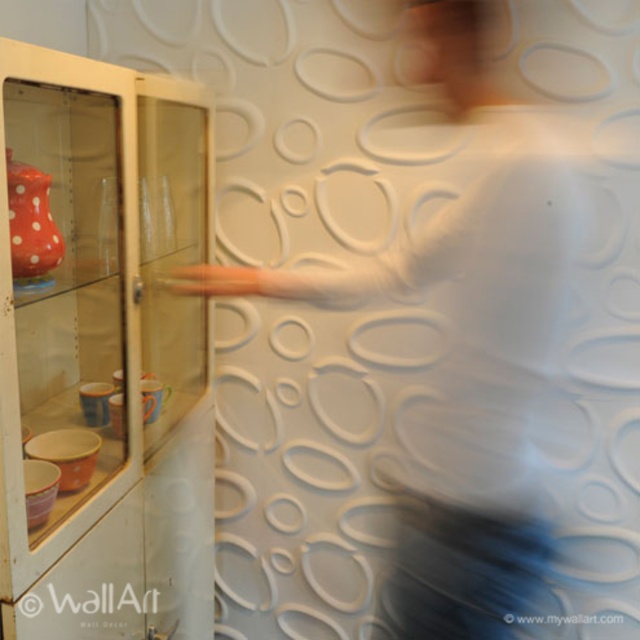
You are standing in the room and want to place a tall plant next to the transparent glass cabinet at left and the white matte shirt at center. Which object should you place it next to if you want the plant to be taller than both?

You should place the tall plant next to the transparent glass cabinet at left because it has a greater height compared to the white matte shirt at center, so the plant will be taller than both.

You are standing in the room and want to place a new ceramic vase on the shelf inside the transparent glass cabinet at left. The shelf is at point (102, 352). Can you reach it without moving the cabinet?

The transparent glass cabinet at left is located at point (102, 352), so yes, you can reach the shelf inside the cabinet at that point without needing to move the cabinet itself.